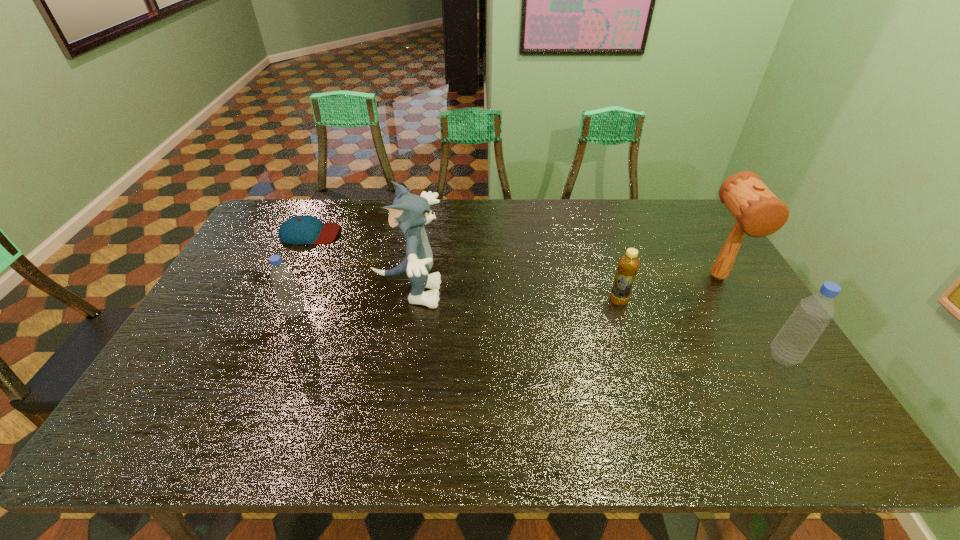
Locate an element on the screen. Image resolution: width=960 pixels, height=540 pixels. free space located on the front-facing side of the cat is located at coordinates (563, 293).

Locate an element on the screen. The width and height of the screenshot is (960, 540). vacant area located 0.170m with the bill of the baseball cap facing forward is located at coordinates (388, 233).

The image size is (960, 540). Find the location of `free point located 0.220m on the front of the second bottle from right to left`. free point located 0.220m on the front of the second bottle from right to left is located at coordinates (641, 370).

Locate an element on the screen. vacant space located on the strike surface of the mallet is located at coordinates (762, 352).

Identify the location of object present at the far edge. (299, 230).

This screenshot has width=960, height=540. Identify the location of object that is positioned at the left edge. (299, 230).

Find the location of a particular element. This screenshot has height=540, width=960. bottle located in the right edge section of the desktop is located at coordinates (793, 342).

Where is `mallet that is at the right edge`? Image resolution: width=960 pixels, height=540 pixels. mallet that is at the right edge is located at coordinates point(758,212).

The height and width of the screenshot is (540, 960). I want to click on object located at the far left corner, so click(299, 230).

Identify the location of free space at the far edge of the desktop. The width and height of the screenshot is (960, 540). (480, 223).